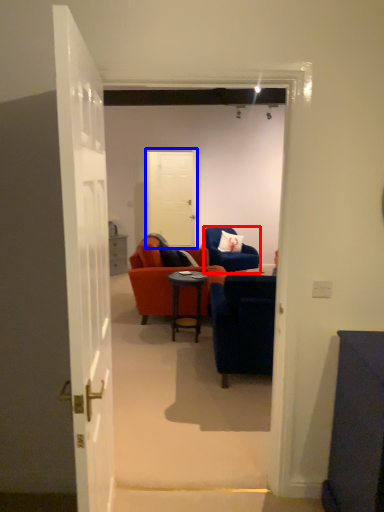
Question: Which object is further to the camera taking this photo, chair (highlighted by a red box) or door (highlighted by a blue box)?

Choices:
 (A) chair
 (B) door

Answer: (B)